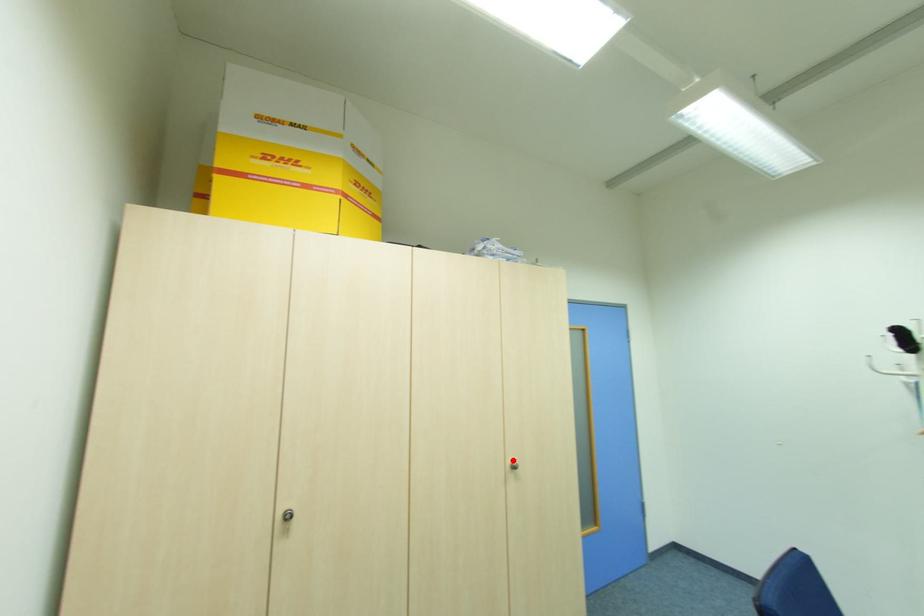
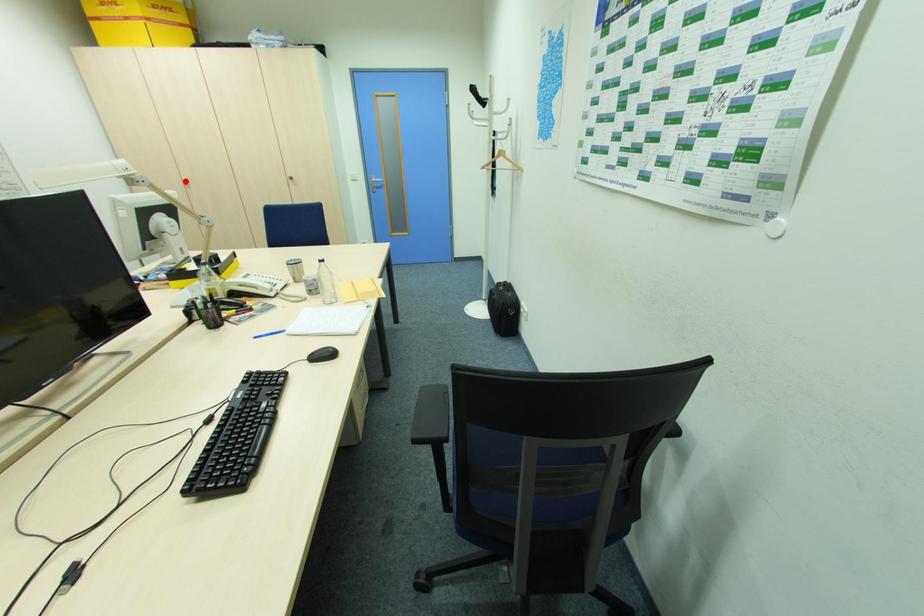
I am providing you with two images of the same scene from different viewpoints. A red point is marked on the first image and another point is marked on the second image. Does the point marked in image1 correspond to the same location as the one in image2?

No